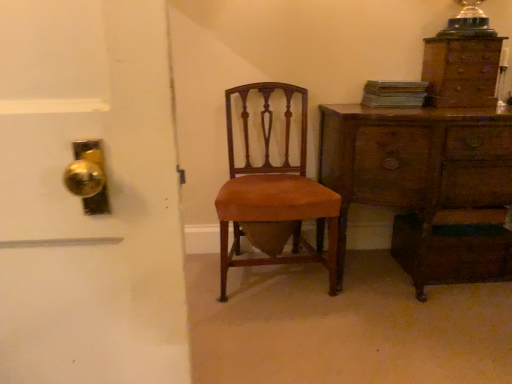
Identify the location of free space between brown wood chair at center and wooden chest of drawers at right, the first chest of drawers positioned from the bottom. (297, 306).